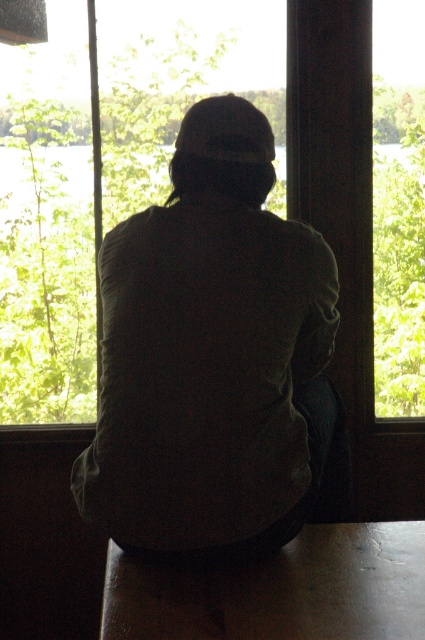
Consider the image. You are standing at the point marked by the camera and want to move towards the person sitting indoors. Which point, point (320, 262) or point (82, 113), should you step on first to reach the person?

You should step on point (320, 262) first because it is in front of point (82, 113), meaning it is closer to your starting position at the camera.

In the scene shown: You are a visitor in this room and want to know if the dark green fabric at center can fit entirely within the transparent glass window at center. Based on their sizes, can it?

The dark green fabric at center is smaller than the transparent glass window at center, so it can fit entirely within the window.